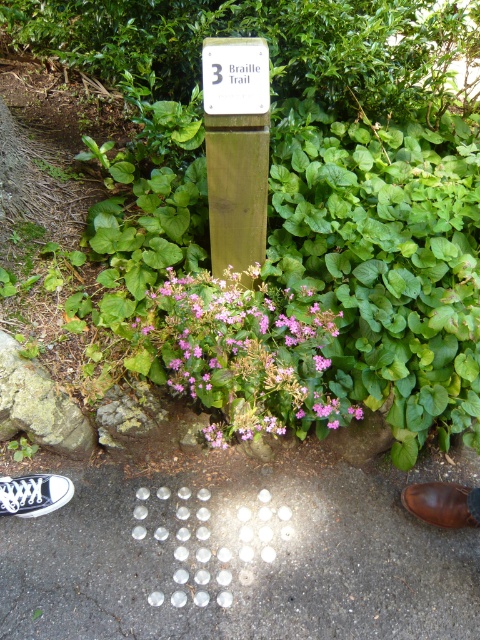
Can you confirm if green leafy bush at upper center is thinner than brown leather shoe at lower right?

No.

Is the position of green leafy bush at upper center more distant than that of brown leather shoe at lower right?

Yes.

This screenshot has width=480, height=640. What are the coordinates of `green leafy bush at upper center` in the screenshot? It's located at (274, 45).

Can you confirm if white plastic sign at center is positioned to the left of brown leather shoe at lower right?

Yes, white plastic sign at center is to the left of brown leather shoe at lower right.

Which of these two, white plastic sign at center or brown leather shoe at lower right, stands shorter?

Standing shorter between the two is brown leather shoe at lower right.

Describe the element at coordinates (236, 76) in the screenshot. The image size is (480, 640). I see `white plastic sign at center` at that location.

At what (x,y) coordinates should I click in order to perform the action: click on white plastic sign at center. Please return your answer as a coordinate pair (x, y). Looking at the image, I should click on (236, 76).

Is green leafy bush at upper center shorter than white plastic sign at center?

In fact, green leafy bush at upper center may be taller than white plastic sign at center.

Who is higher up, green leafy bush at upper center or white plastic sign at center?

green leafy bush at upper center

The width and height of the screenshot is (480, 640). What are the coordinates of `green leafy bush at upper center` in the screenshot? It's located at (274, 45).

I want to click on green leafy bush at upper center, so click(274, 45).